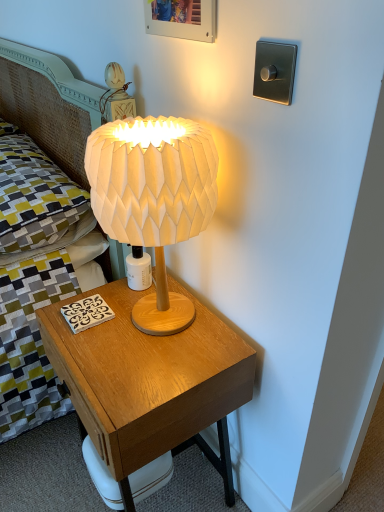
Question: Are wooden nightstand at center and yellow-green fabric pillow at upper left beside each other?

Choices:
 (A) yes
 (B) no

Answer: (B)

Question: Could you tell me if wooden nightstand at center is turned towards yellow-green fabric pillow at upper left?

Choices:
 (A) yes
 (B) no

Answer: (B)

Question: Considering the relative sizes of wooden nightstand at center and yellow-green fabric pillow at upper left in the image provided, is wooden nightstand at center bigger than yellow-green fabric pillow at upper left?

Choices:
 (A) no
 (B) yes

Answer: (B)

Question: Can you confirm if wooden nightstand at center is positioned to the left of yellow-green fabric pillow at upper left?

Choices:
 (A) no
 (B) yes

Answer: (A)

Question: From the image's perspective, is wooden nightstand at center located above yellow-green fabric pillow at upper left?

Choices:
 (A) no
 (B) yes

Answer: (A)

Question: In the image, is wooden picture frame at upper center positioned in front of or behind white paper lampshade at center?

Choices:
 (A) front
 (B) behind

Answer: (B)

Question: From the image's perspective, relative to white paper lampshade at center, is wooden picture frame at upper center above or below?

Choices:
 (A) below
 (B) above

Answer: (B)

Question: Considering the positions of point (205, 36) and point (150, 220), is point (205, 36) closer or farther from the camera than point (150, 220)?

Choices:
 (A) closer
 (B) farther

Answer: (B)

Question: In terms of height, does wooden picture frame at upper center look taller or shorter compared to white paper lampshade at center?

Choices:
 (A) short
 (B) tall

Answer: (A)

Question: Is point (153, 25) closer or farther from the camera than point (69, 208)?

Choices:
 (A) farther
 (B) closer

Answer: (B)

Question: Is wooden picture frame at upper center taller or shorter than yellow-green fabric pillow at upper left?

Choices:
 (A) short
 (B) tall

Answer: (A)

Question: Considering the positions of wooden picture frame at upper center and yellow-green fabric pillow at upper left in the image, is wooden picture frame at upper center wider or thinner than yellow-green fabric pillow at upper left?

Choices:
 (A) wide
 (B) thin

Answer: (B)

Question: Is wooden picture frame at upper center bigger or smaller than yellow-green fabric pillow at upper left?

Choices:
 (A) big
 (B) small

Answer: (B)

Question: From a real-world perspective, is wooden nightstand at center positioned above or below yellow-green fabric pillow at upper left?

Choices:
 (A) below
 (B) above

Answer: (A)

Question: Is point (52, 354) closer or farther from the camera than point (1, 265)?

Choices:
 (A) farther
 (B) closer

Answer: (B)